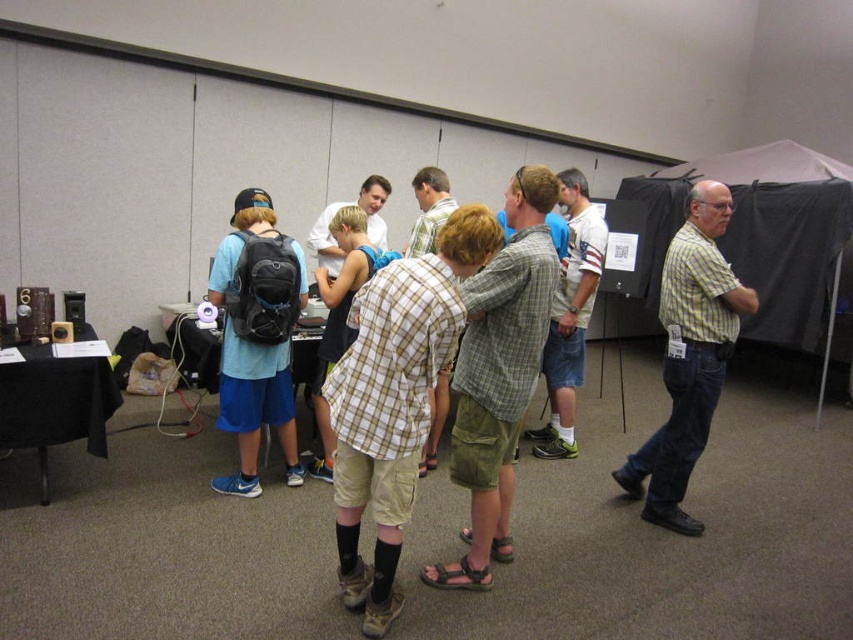
Between plaid cotton shirt at center and yellow-green plaid shirt at right, which one is positioned lower?

plaid cotton shirt at center

Does plaid cotton shirt at center have a lesser width compared to yellow-green plaid shirt at right?

No.

This screenshot has width=853, height=640. Identify the location of plaid cotton shirt at center. (393, 400).

This screenshot has height=640, width=853. I want to click on green plaid shirt at center, so click(498, 372).

From the picture: Who is higher up, green plaid shirt at center or yellow-green plaid shirt at right?

yellow-green plaid shirt at right

Describe the element at coordinates (498, 372) in the screenshot. This screenshot has width=853, height=640. I see `green plaid shirt at center` at that location.

Find the location of a particular element. The height and width of the screenshot is (640, 853). green plaid shirt at center is located at coordinates (498, 372).

Looking at this image, does light blue t-shirt at left come behind light gray plaid shirt at center?

No, light blue t-shirt at left is closer to the viewer.

Is light blue t-shirt at left smaller than light gray plaid shirt at center?

Yes.

Does point (270, 234) come behind point (581, 301)?

No, it is not.

Where is `light blue t-shirt at left`? This screenshot has height=640, width=853. light blue t-shirt at left is located at coordinates (254, 406).